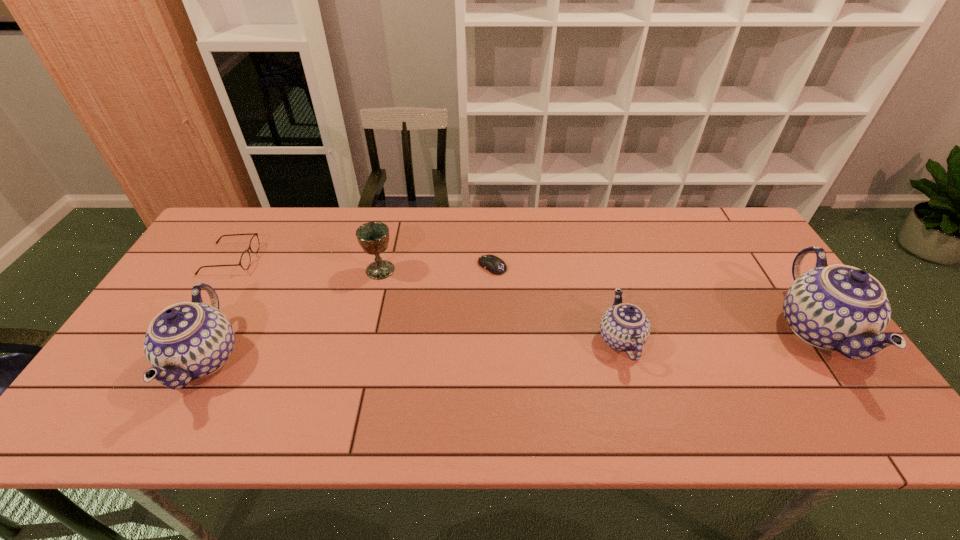
Where is `the second tallest object`? the second tallest object is located at coordinates (188, 340).

Locate an element on the screen. The height and width of the screenshot is (540, 960). the second shortest chinaware is located at coordinates (188, 340).

Identify the location of the second object from right to left. (x=624, y=327).

Find the location of a particular element. the shortest chinaware is located at coordinates (624, 327).

Locate an element on the screen. This screenshot has width=960, height=540. the rightmost object is located at coordinates (838, 307).

The image size is (960, 540). I want to click on spectacles, so click(245, 260).

Identify the location of the shortest object. (495, 265).

At what (x,y) coordinates should I click in order to perform the action: click on the fourth object from left to right. Please return your answer as a coordinate pair (x, y). Looking at the image, I should click on (495, 265).

Identify the location of chalice. The image size is (960, 540). (373, 237).

At what (x,y) coordinates should I click in order to perform the action: click on the fourth object from right to left. Please return your answer as a coordinate pair (x, y). Looking at the image, I should click on (373, 237).